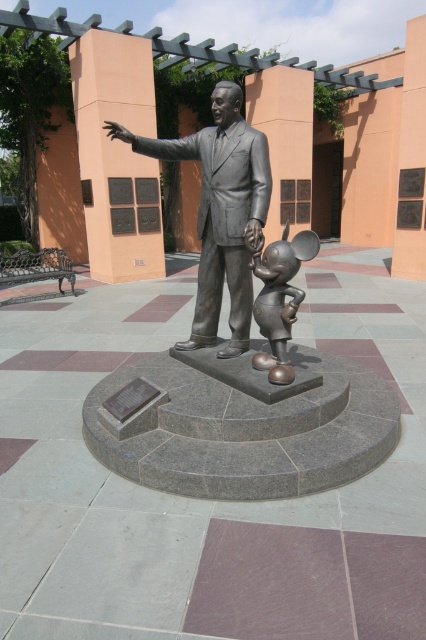
Question: Can you confirm if polished bronze statue at center is thinner than bronze mickey mouse at center?

Choices:
 (A) no
 (B) yes

Answer: (A)

Question: Which point is farther to the camera?

Choices:
 (A) polished bronze statue at center
 (B) bronze mickey mouse at center

Answer: (A)

Question: Among these points, which one is farthest from the camera?

Choices:
 (A) (301, 259)
 (B) (210, 160)

Answer: (B)

Question: In this image, where is polished bronze statue at center located relative to bronze mickey mouse at center?

Choices:
 (A) left
 (B) right

Answer: (A)

Question: Can you confirm if polished bronze statue at center is positioned below bronze mickey mouse at center?

Choices:
 (A) yes
 (B) no

Answer: (B)